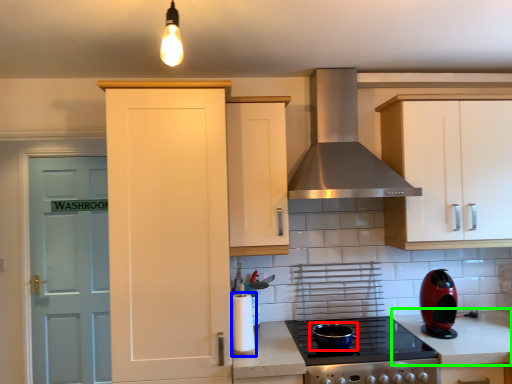
Question: Estimate the real-world distances between objects in this image. Which object is closer to appliance (highlighted by a red box), appliance (highlighted by a blue box) or counter top (highlighted by a green box)?

Choices:
 (A) appliance
 (B) counter top

Answer: (A)